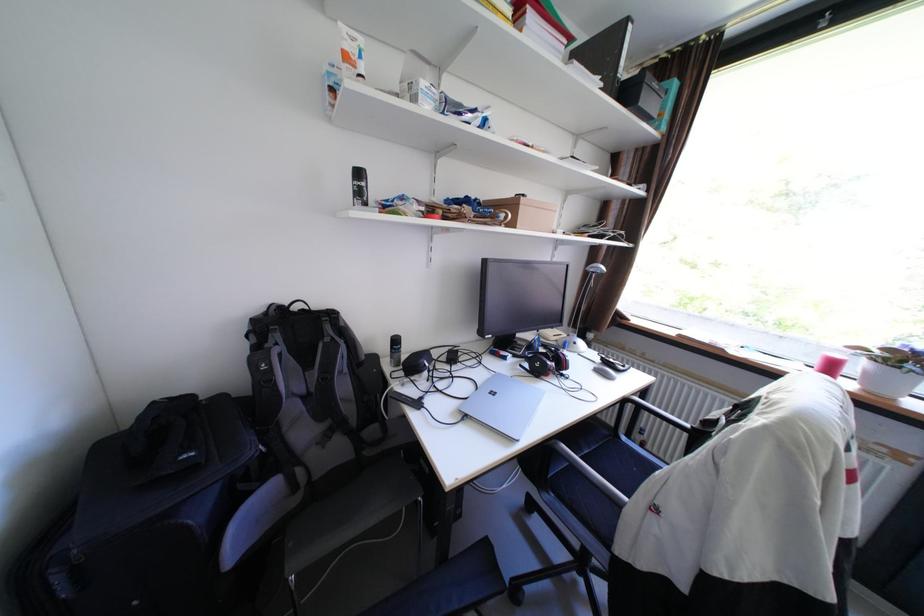
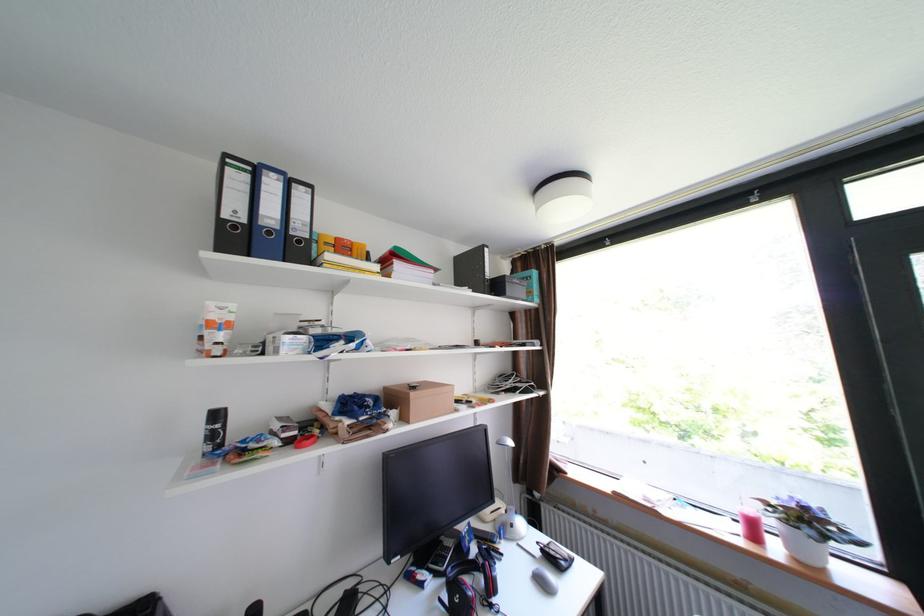
The point at (371, 195) is marked in the first image. Where is the corresponding point in the second image?

(225, 436)